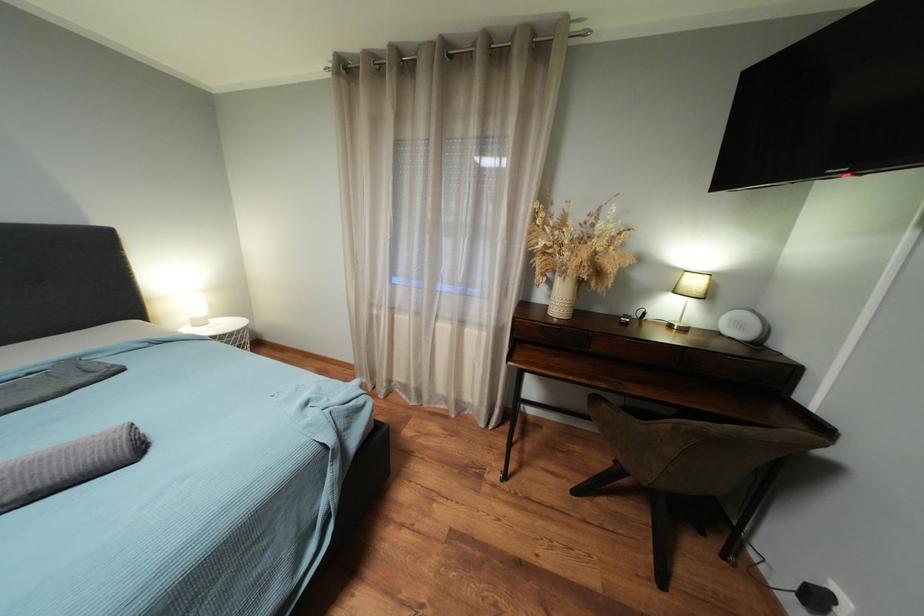
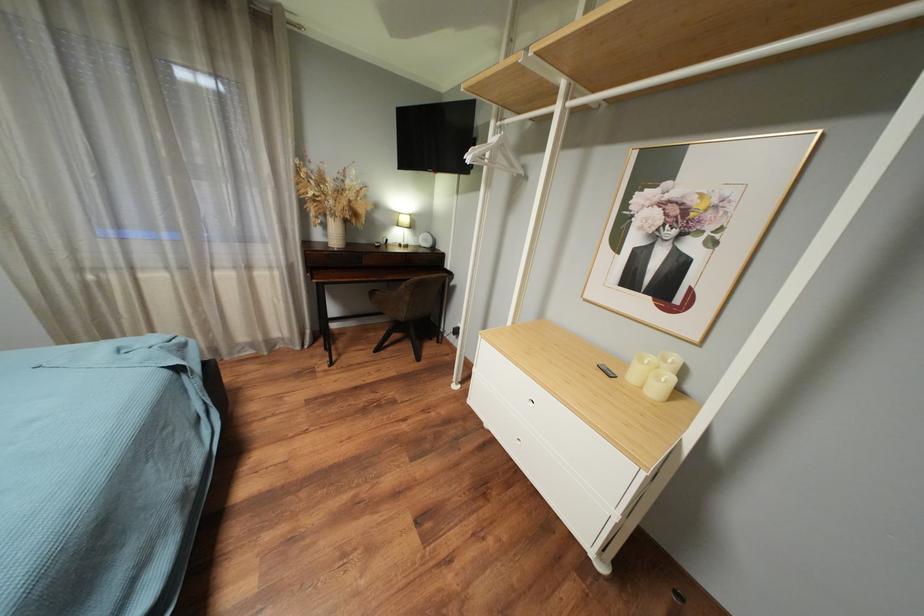
Question: The camera is either moving clockwise (left) or counter-clockwise (right) around the object. The first image is from the beginning of the video and the second image is from the end. Is the camera moving left or right when shooting the video?

Choices:
 (A) Left
 (B) Right

Answer: (A)